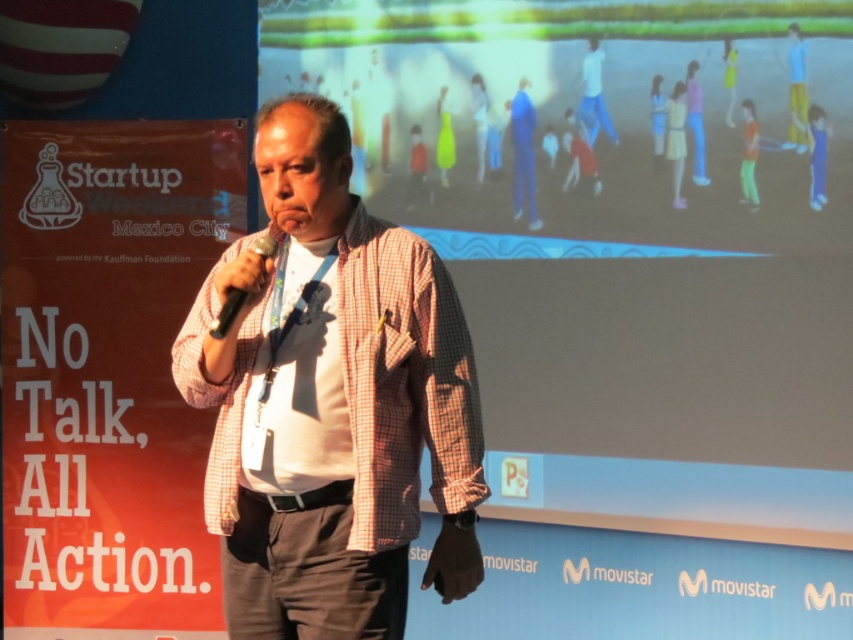
Question: Does checkered fabric shirt at center appear on the right side of black plastic microphone at center?

Choices:
 (A) no
 (B) yes

Answer: (B)

Question: Which point is closer to the camera?

Choices:
 (A) checkered fabric shirt at center
 (B) black plastic microphone at center

Answer: (A)

Question: Is checkered fabric shirt at center positioned before black plastic microphone at center?

Choices:
 (A) yes
 (B) no

Answer: (A)

Question: Among these points, which one is farthest from the camera?

Choices:
 (A) (456, 596)
 (B) (235, 300)

Answer: (A)

Question: Is checkered fabric shirt at center positioned behind black plastic microphone at center?

Choices:
 (A) yes
 (B) no

Answer: (B)

Question: Which point is farther to the camera?

Choices:
 (A) (228, 324)
 (B) (479, 579)

Answer: (B)